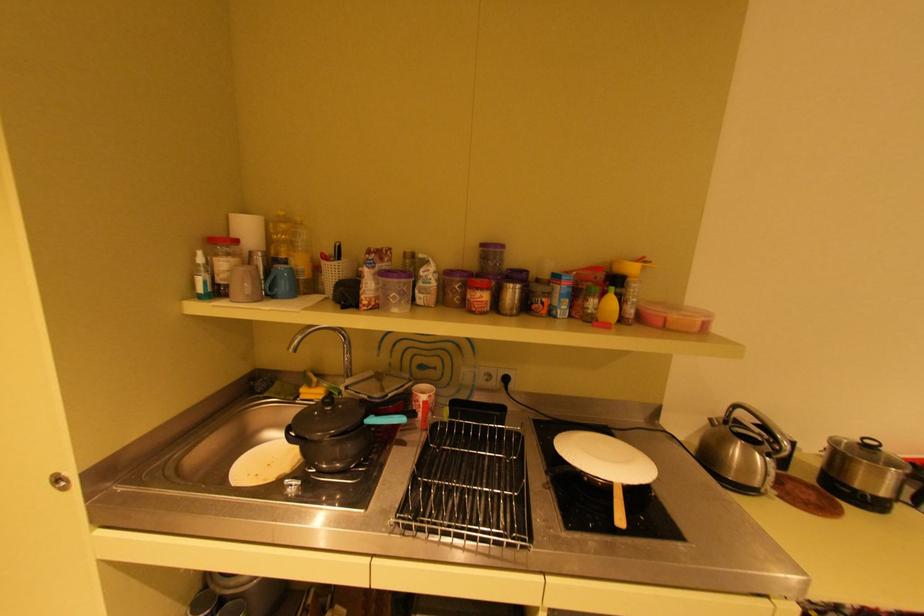
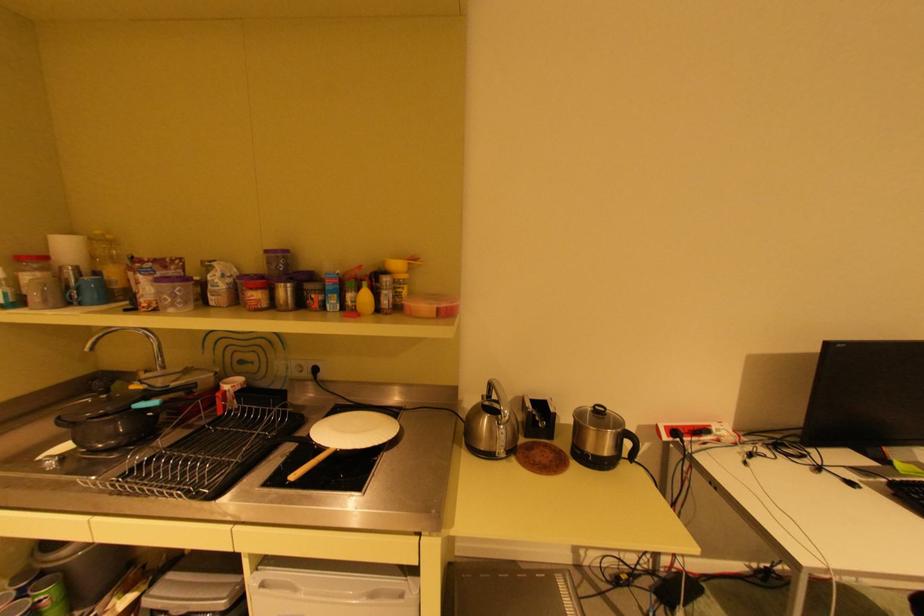
In the second image, find the point that corresponds to point (621, 483) in the first image.

(337, 448)